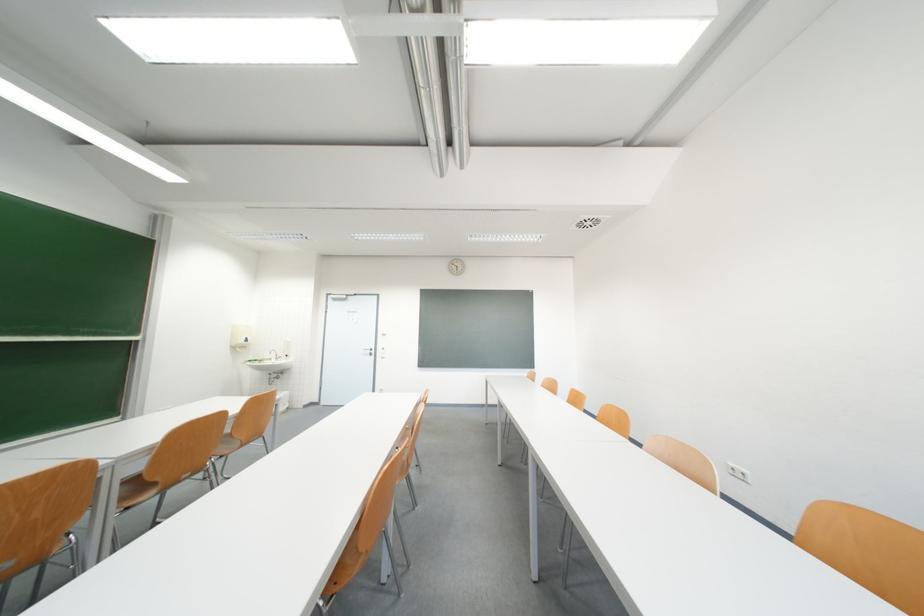
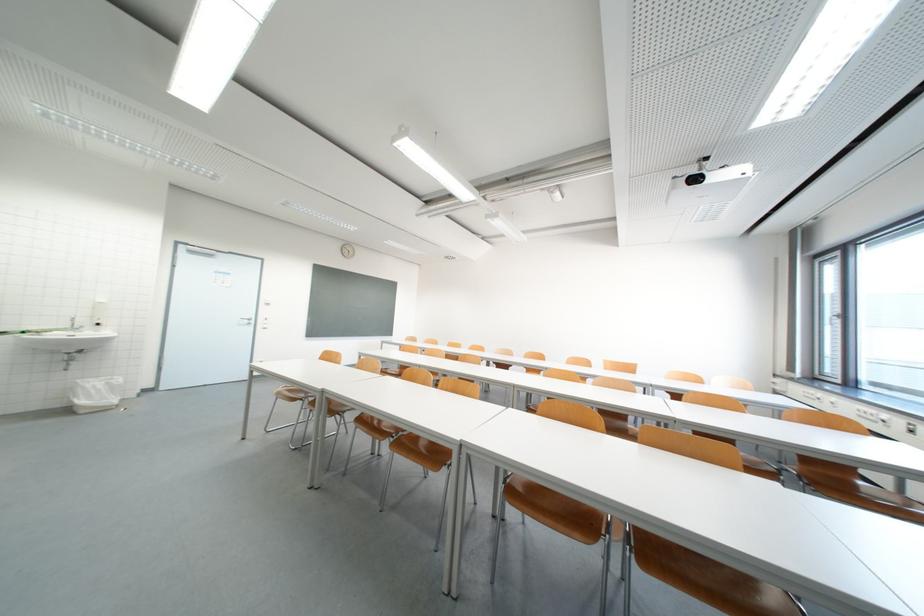
Find the pixel in the second image that matches pixel 382 354 in the first image.

(261, 323)